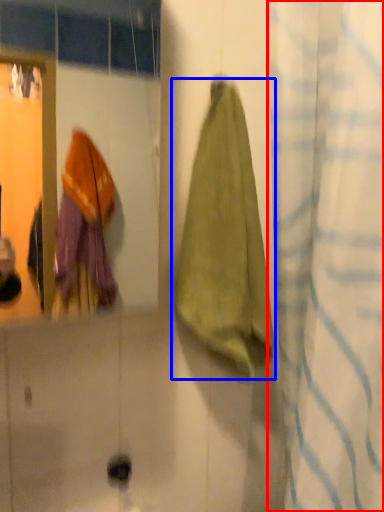
Question: Which point is further to the camera, curtain (highlighted by a red box) or towel (highlighted by a blue box)?

Choices:
 (A) curtain
 (B) towel

Answer: (B)